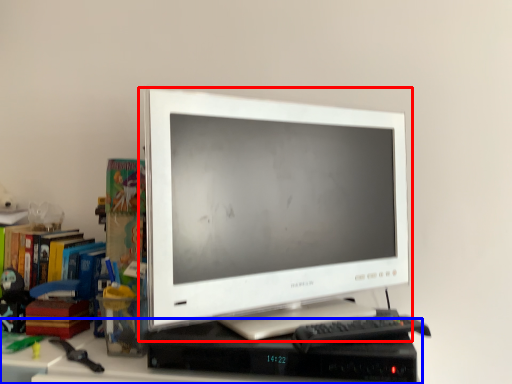
Question: Which point is closer to the camera, computer monitor (highlighted by a red box) or computer desk (highlighted by a blue box)?

Choices:
 (A) computer monitor
 (B) computer desk

Answer: (B)